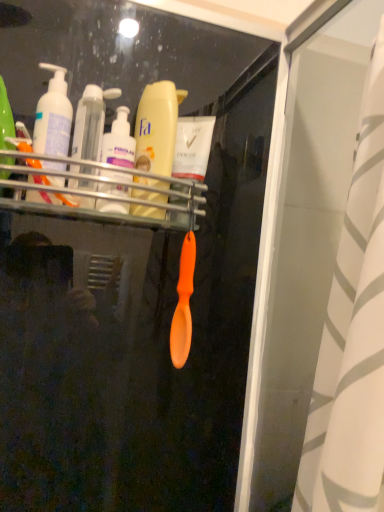
Question: Is white striped fabric at right facing away from translucent plastic bottles at center, marked as the first toiletry in a right-to-left arrangement?

Choices:
 (A) no
 (B) yes

Answer: (B)

Question: Is white striped fabric at right wider than translucent plastic bottles at center, marked as the first toiletry in a right-to-left arrangement?

Choices:
 (A) no
 (B) yes

Answer: (B)

Question: From the image's perspective, is white striped fabric at right on top of translucent plastic bottles at center, arranged as the second toiletry when viewed from the left?

Choices:
 (A) yes
 (B) no

Answer: (B)

Question: Considering the relative positions of white striped fabric at right and translucent plastic bottles at center, marked as the first toiletry in a right-to-left arrangement, in the image provided, is white striped fabric at right to the right of translucent plastic bottles at center, marked as the first toiletry in a right-to-left arrangement, from the viewer's perspective?

Choices:
 (A) yes
 (B) no

Answer: (A)

Question: Considering the relative sizes of white striped fabric at right and translucent plastic bottles at center, marked as the first toiletry in a right-to-left arrangement, in the image provided, is white striped fabric at right thinner than translucent plastic bottles at center, marked as the first toiletry in a right-to-left arrangement,?

Choices:
 (A) yes
 (B) no

Answer: (B)

Question: From a real-world perspective, is translucent plastic bottles at center left, the second toiletry when ordered from right to left, above or below matte white pump bottle at left?

Choices:
 (A) above
 (B) below

Answer: (B)

Question: Is point (87, 153) positioned closer to the camera than point (48, 163)?

Choices:
 (A) closer
 (B) farther

Answer: (B)

Question: Is translucent plastic bottles at center left, which ranks as the 1th toiletry in left-to-right order, wider or thinner than matte white pump bottle at left?

Choices:
 (A) thin
 (B) wide

Answer: (A)

Question: Based on their sizes in the image, would you say translucent plastic bottles at center left, the second toiletry when ordered from right to left, is bigger or smaller than matte white pump bottle at left?

Choices:
 (A) small
 (B) big

Answer: (A)

Question: Is point (382, 412) positioned closer to the camera than point (127, 135)?

Choices:
 (A) farther
 (B) closer

Answer: (B)

Question: Considering their positions, is white striped fabric at right located in front of or behind translucent plastic bottles at center, arranged as the second toiletry when viewed from the left?

Choices:
 (A) behind
 (B) front

Answer: (B)

Question: From the image's perspective, is white striped fabric at right above or below translucent plastic bottles at center, arranged as the second toiletry when viewed from the left?

Choices:
 (A) above
 (B) below

Answer: (B)

Question: Do you think white striped fabric at right is within translucent plastic bottles at center, arranged as the second toiletry when viewed from the left, or outside of it?

Choices:
 (A) outside
 (B) inside

Answer: (A)

Question: Is point (39, 200) closer or farther from the camera than point (137, 194)?

Choices:
 (A) closer
 (B) farther

Answer: (A)

Question: From the image's perspective, is matte white pump bottle at left positioned above or below yellow matte lotion at center?

Choices:
 (A) above
 (B) below

Answer: (A)